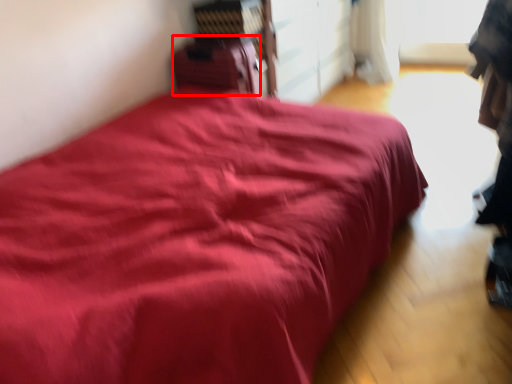
Question: From the image's perspective, considering the relative positions of luggage (annotated by the red box) and bed in the image provided, where is luggage (annotated by the red box) located with respect to the staircase?

Choices:
 (A) below
 (B) above

Answer: (B)